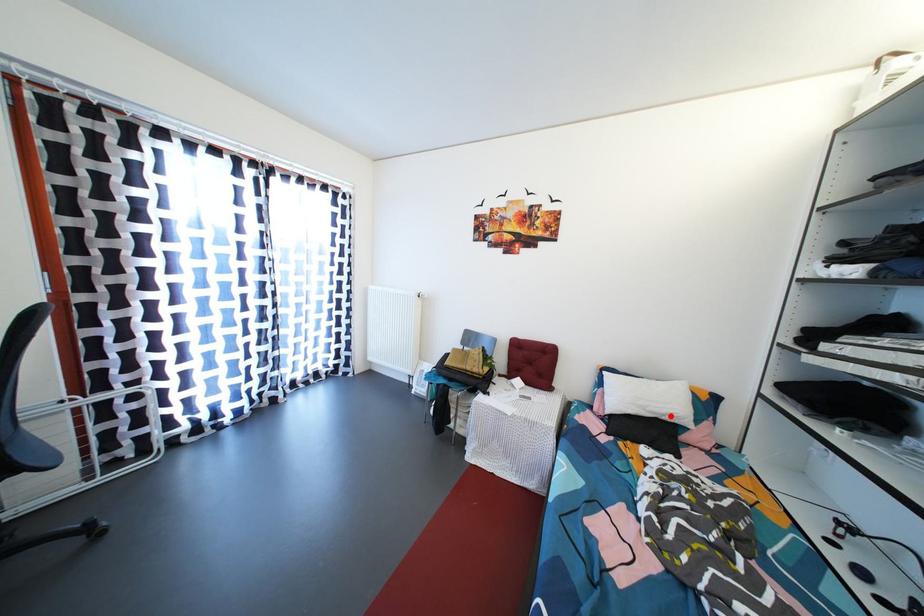
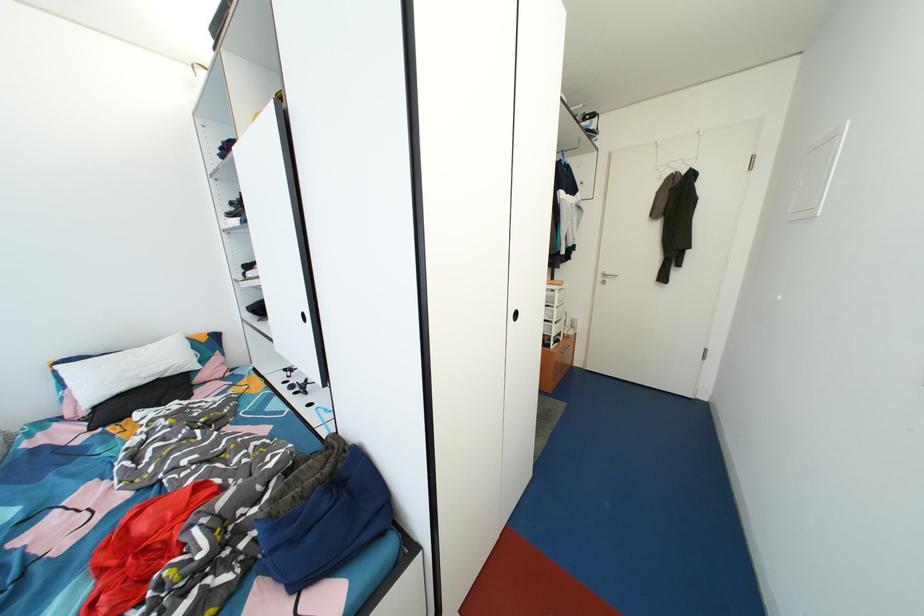
Locate, in the second image, the point that corresponds to the highlighted location in the first image.

(167, 373)